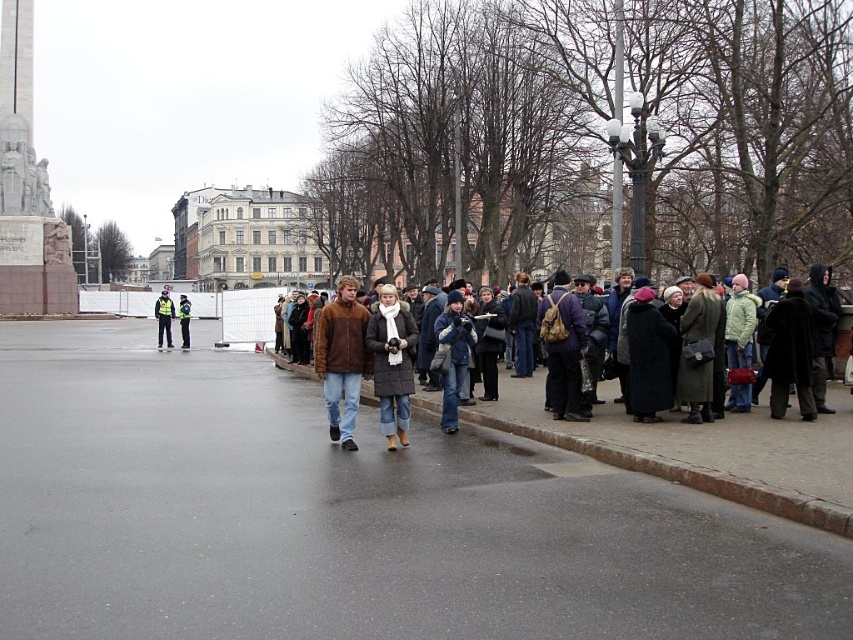
Does purple fabric backpack at center-right come behind yellow reflective jacket at center?

No, purple fabric backpack at center-right is closer to the viewer.

Does point (556, 317) lie in front of point (161, 308)?

Yes, point (556, 317) is in front of point (161, 308).

Image resolution: width=853 pixels, height=640 pixels. Identify the location of purple fabric backpack at center-right. (561, 348).

Who is shorter, brown fuzzy jacket at center or reflective yellow jacket at center?

With less height is brown fuzzy jacket at center.

Is point (335, 419) closer to viewer compared to point (186, 346)?

That is True.

Find the location of a particular element. brown fuzzy jacket at center is located at coordinates click(341, 358).

Does brown fuzzy jacket at center have a lesser height compared to purple fabric backpack at center-right?

In fact, brown fuzzy jacket at center may be taller than purple fabric backpack at center-right.

Can you confirm if brown fuzzy jacket at center is positioned to the right of purple fabric backpack at center-right?

In fact, brown fuzzy jacket at center is to the left of purple fabric backpack at center-right.

Does point (357, 355) lie behind point (554, 384)?

No, it is not.

You are a GUI agent. You are given a task and a screenshot of the screen. Output one action in this format:
    pyautogui.click(x=<x>, y=<y>)
    Task: Click on the brown fuzzy jacket at center
    This screenshot has height=640, width=853.
    Given the screenshot: What is the action you would take?
    pyautogui.click(x=341, y=358)